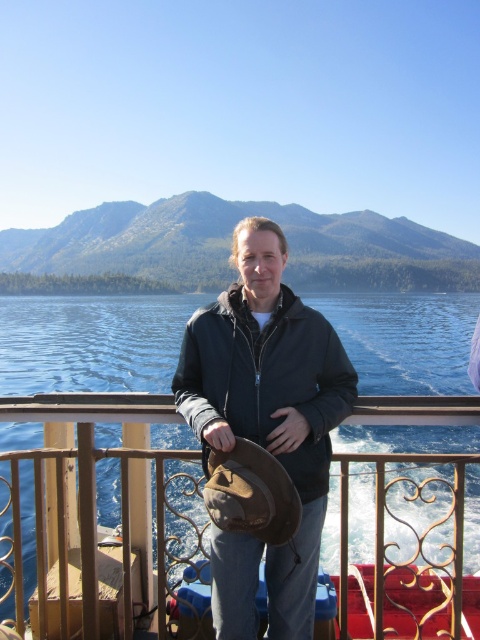
Does brown leather hat at center appear on the right side of matte black jacket at center?

In fact, brown leather hat at center is to the left of matte black jacket at center.

Measure the distance between point (x=7, y=609) and camera.

Point (x=7, y=609) is 9.61 meters from camera.

Locate an element on the screen. This screenshot has height=640, width=480. brown leather hat at center is located at coordinates (96, 515).